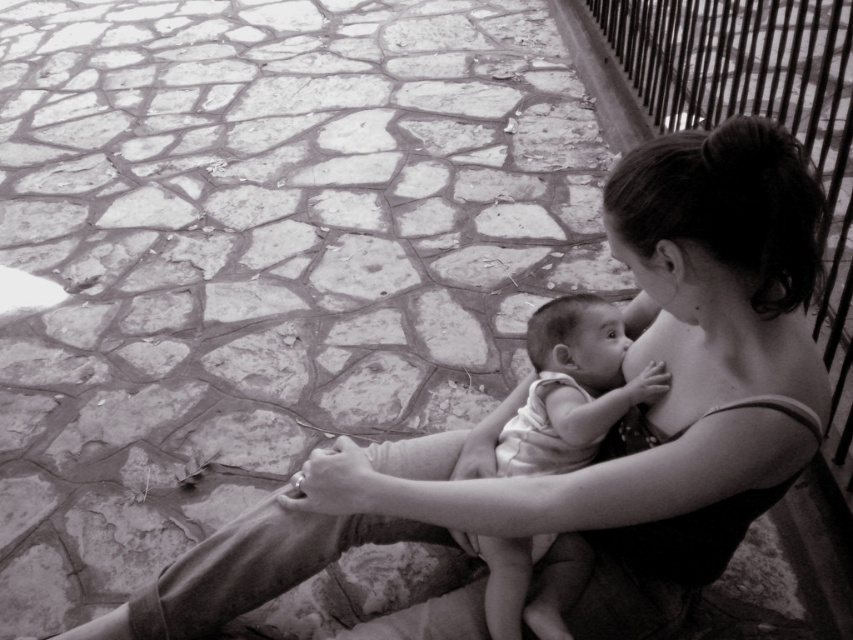
You are a photographer trying to capture a candid shot of the white clothed baby at center without the metallic wire fence at upper right appearing in the frame. Based on their relative heights, can you suggest a way to adjust your camera angle to achieve this?

The metallic wire fence at upper right is much taller than the white clothed baby at center. To avoid the fence in the frame, lower your camera angle so that the baby occupies the lower part of the frame while the fence remains out of sight above.

You are a photographer adjusting your camera to focus on two points in the scene. The first point is at coordinates point (788, 24) and the second is at point (561, 387). Which point should you focus on first if you want to ensure the closest object is in sharp focus?

Point (788, 24) is further to the camera than point (561, 387), so you should focus on point (788, 24) first to capture the closest object in sharp focus.